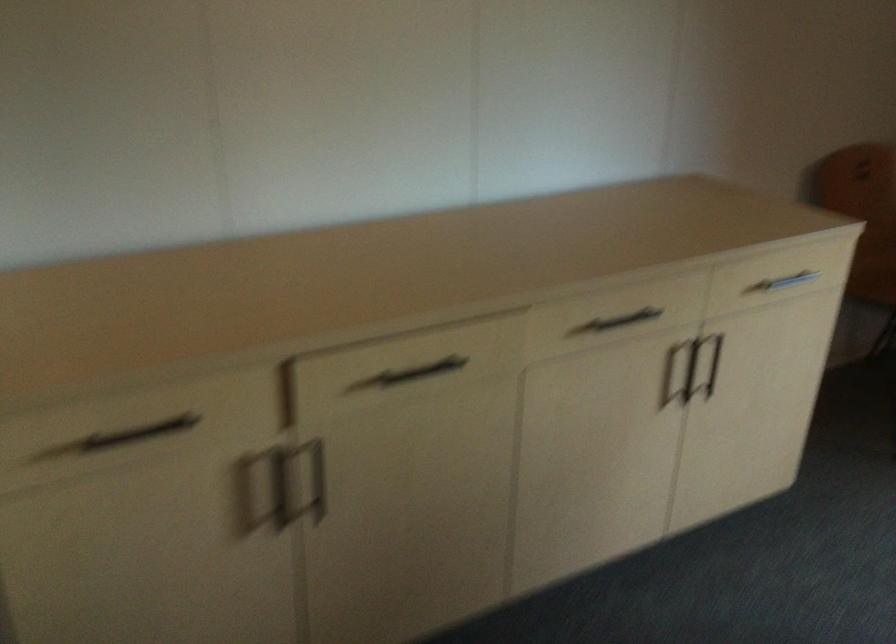
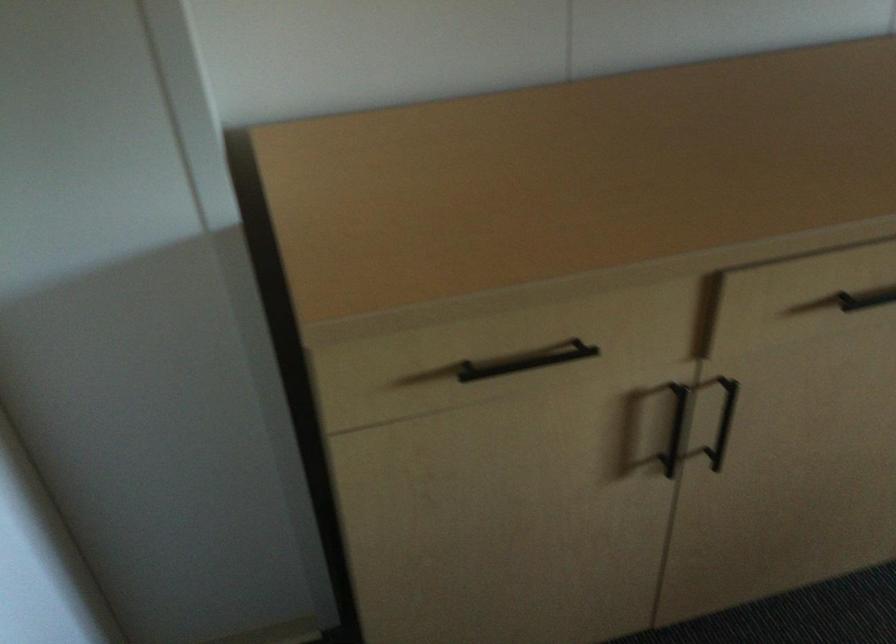
Locate, in the second image, the point that corresponds to the point at 409,380 in the first image.

(866, 299)